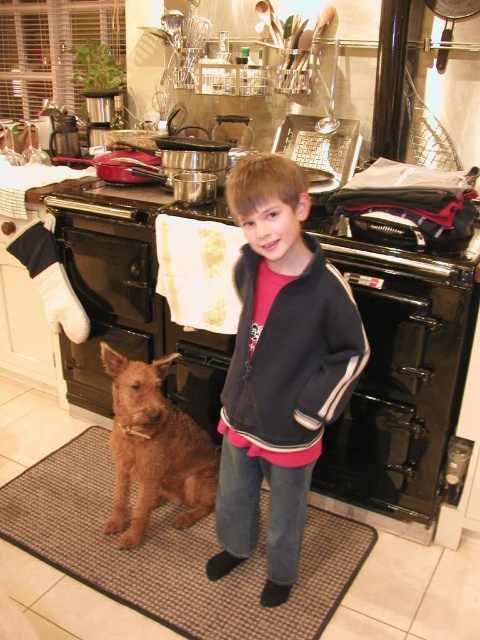
Can you confirm if dark blue fleece sweatshirt at center is taller than black fabric oven mitt at left?

Correct, dark blue fleece sweatshirt at center is much taller as black fabric oven mitt at left.

Is point (275, 330) positioned behind point (38, 234)?

No, it is in front of (38, 234).

You are a GUI agent. You are given a task and a screenshot of the screen. Output one action in this format:
    pyautogui.click(x=<x>, y=<y>)
    Task: Click on the dark blue fleece sweatshirt at center
    Image resolution: width=480 pixels, height=640 pixels.
    Given the screenshot: What is the action you would take?
    pyautogui.click(x=294, y=355)

Is the position of black fleece jacket at center less distant than that of shaggy brown dog at lower left?

Yes, it is.

I want to click on black fleece jacket at center, so click(x=278, y=369).

Identify the location of black fleece jacket at center. This screenshot has width=480, height=640. (278, 369).

Is dark blue fleece sweatshirt at center thinner than shaggy brown dog at lower left?

Indeed, dark blue fleece sweatshirt at center has a lesser width compared to shaggy brown dog at lower left.

Is point (248, 364) behind point (117, 497)?

No, it is in front of (117, 497).

Find the location of a particular element. This screenshot has width=480, height=640. dark blue fleece sweatshirt at center is located at coordinates (294, 355).